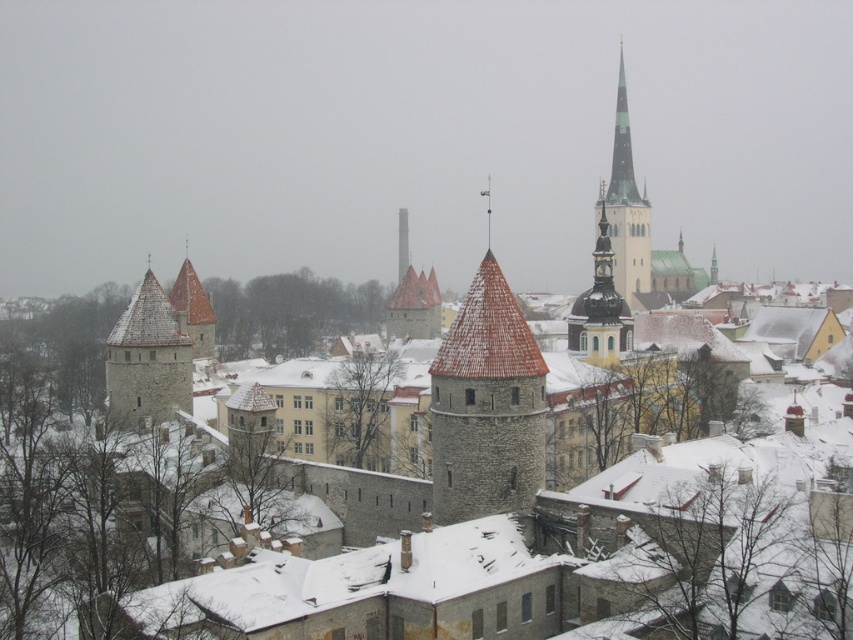
Between point (486, 467) and point (196, 353), which one is positioned in front?

Point (486, 467)

Between point (486, 401) and point (204, 308), which one is positioned in front?

Point (486, 401) is in front.

You are a GUI agent. You are given a task and a screenshot of the screen. Output one action in this format:
    pyautogui.click(x=<x>, y=<y>)
    Task: Click on the smooth stone tower at center
    The width and height of the screenshot is (853, 640).
    Given the screenshot: What is the action you would take?
    pyautogui.click(x=486, y=404)

Does point (514, 307) come closer to viewer compared to point (593, 294)?

Yes, it is.

Does smooth stone tower at center appear over smooth gold clock tower at center?

Incorrect, smooth stone tower at center is not positioned above smooth gold clock tower at center.

Is point (453, 513) positioned before point (606, 356)?

Yes.

Identify the location of smooth stone tower at center. (486, 404).

In the scene shown: Can you confirm if brown stone tower at center is thinner than smooth gray stone tower at center?

No, brown stone tower at center is not thinner than smooth gray stone tower at center.

Which is in front, point (187, 291) or point (399, 232)?

Point (187, 291)

Where is `brown stone tower at center`? This screenshot has height=640, width=853. brown stone tower at center is located at coordinates (193, 308).